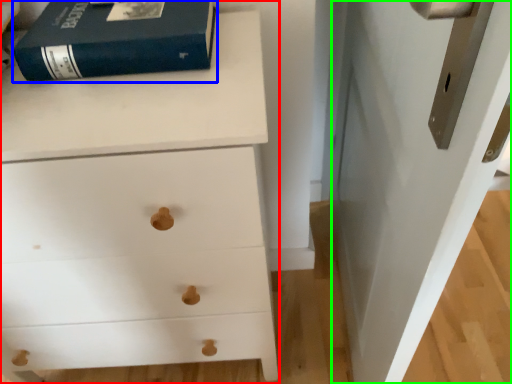
Question: Considering the real-world distances, which object is closest to chest of drawers (highlighted by a red box)? paperback book (highlighted by a blue box) or door (highlighted by a green box).

Choices:
 (A) paperback book
 (B) door

Answer: (A)